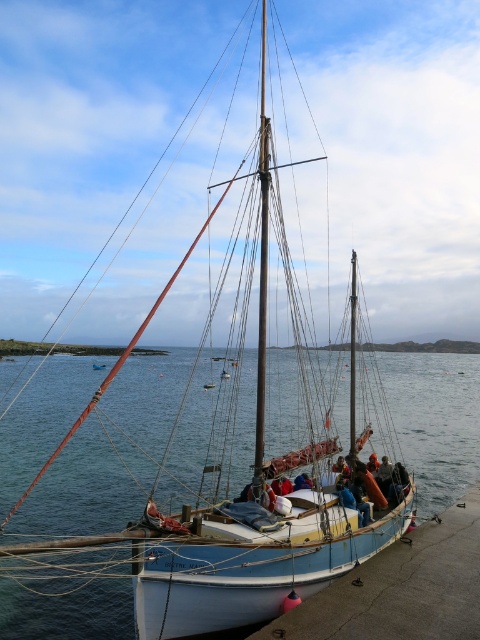
You are a sailor standing on the deck of the boat and need to reach the polished silver mast at center. The blue water at center is between you and the mast. Can you safely walk to the mast without stepping into the water?

The blue water at center and polished silver mast at center are 33.73 meters apart. Since the water is between you and the mast, you would need to walk around it or find another path, as the distance suggests the mast is far from the water, but the exact path isn